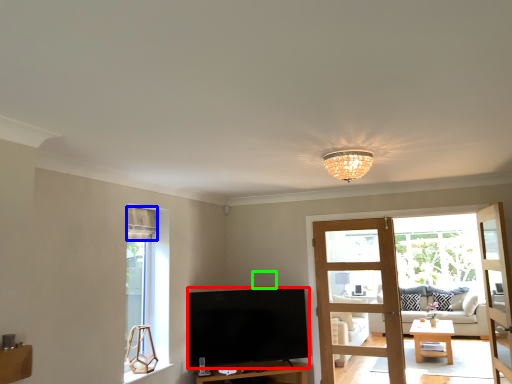
Question: Considering the real-world distances, which object is farthest from television (highlighted by a red box)? curtain (highlighted by a blue box) or loudspeaker (highlighted by a green box)?

Choices:
 (A) curtain
 (B) loudspeaker

Answer: (A)